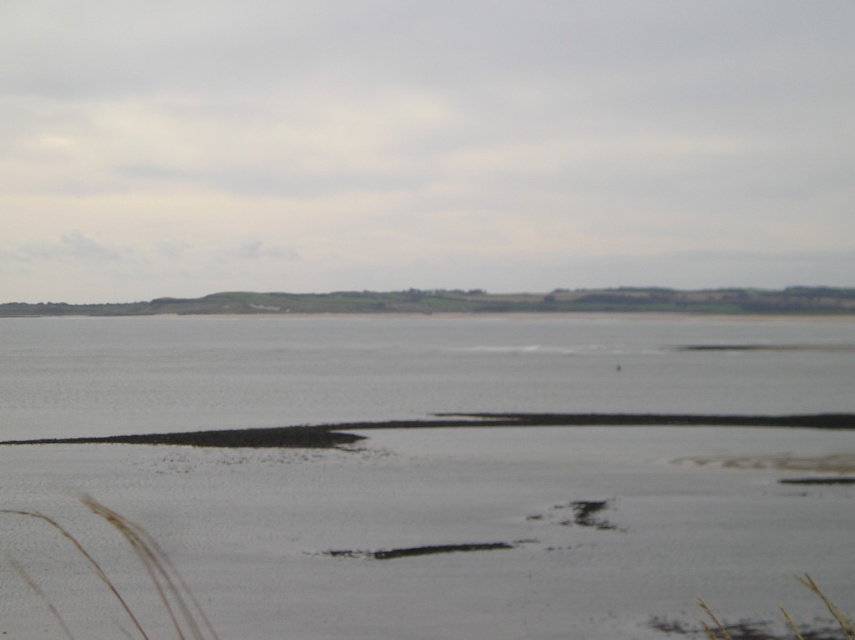
Is point (718, 513) more distant than point (77, 376)?

No, (718, 513) is in front of (77, 376).

Is point (675, 518) closer to viewer compared to point (12, 340)?

Yes, point (675, 518) is closer to viewer.

Where is `white sandy beach at lower center`? Image resolution: width=855 pixels, height=640 pixels. white sandy beach at lower center is located at coordinates (467, 529).